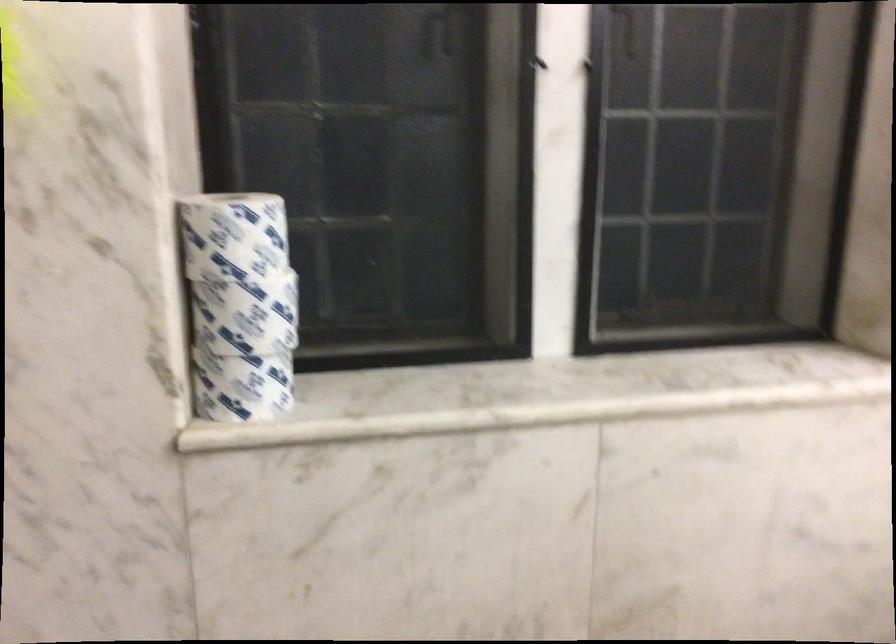
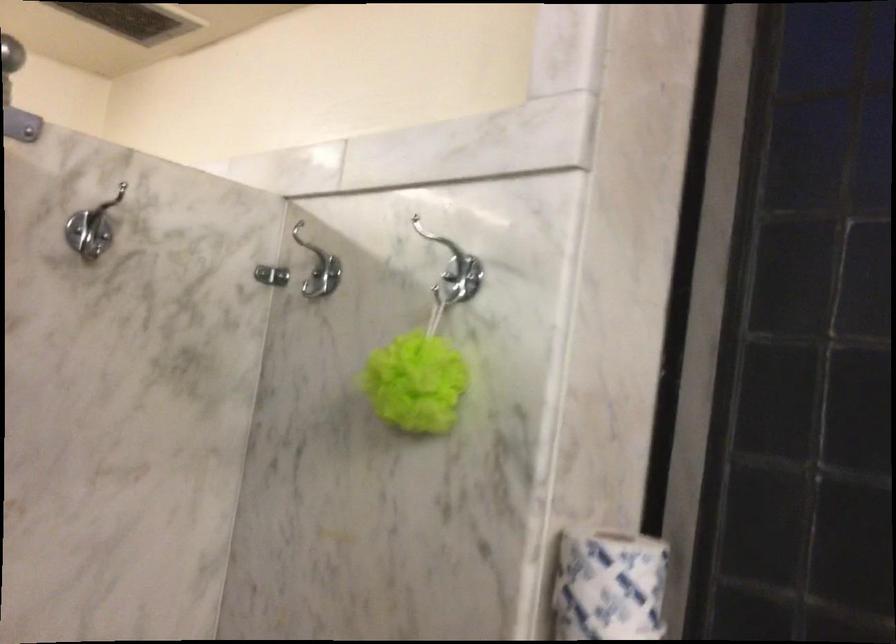
Locate, in the second image, the point that corresponds to [260,243] in the first image.

(607, 585)